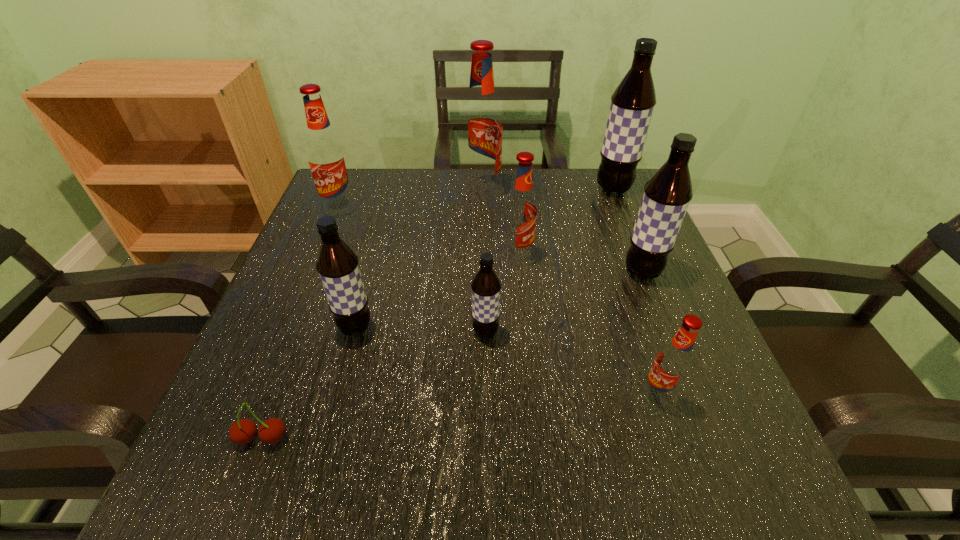
The image size is (960, 540). What are the coordinates of `vacant space that is in between the second smallest red root beer and the third brown root beer from right to left` in the screenshot? It's located at (502, 294).

Locate an element on the screen. the fifth closest object to the third smallest red root beer is located at coordinates (271, 431).

Locate an element on the screen. The height and width of the screenshot is (540, 960). object identified as the seventh closest to the leftmost red root beer is located at coordinates (667, 194).

Find the location of `the third closest root beer to the third object from left to right`. the third closest root beer to the third object from left to right is located at coordinates (326, 156).

Where is `root beer identified as the sixth closest to the smallest brown root beer`? root beer identified as the sixth closest to the smallest brown root beer is located at coordinates (326, 156).

Identify the location of brown root beer that is the third closest to the nearest red root beer. (337, 264).

What are the coordinates of `brown root beer that stands as the closest to the third biggest brown root beer` in the screenshot? It's located at (486, 286).

Find the location of a particular element. The width and height of the screenshot is (960, 540). red root beer object that ranks as the closest to the second biggest brown root beer is located at coordinates (521, 210).

Where is `red root beer that is the closest to the biggest brown root beer`? red root beer that is the closest to the biggest brown root beer is located at coordinates (481, 125).

Where is `vacant space that satisfies the following two spatial constraints: 1. on the back side of the smallest brown root beer; 2. on the left side of the second nearest red root beer`? This screenshot has width=960, height=540. vacant space that satisfies the following two spatial constraints: 1. on the back side of the smallest brown root beer; 2. on the left side of the second nearest red root beer is located at coordinates (485, 255).